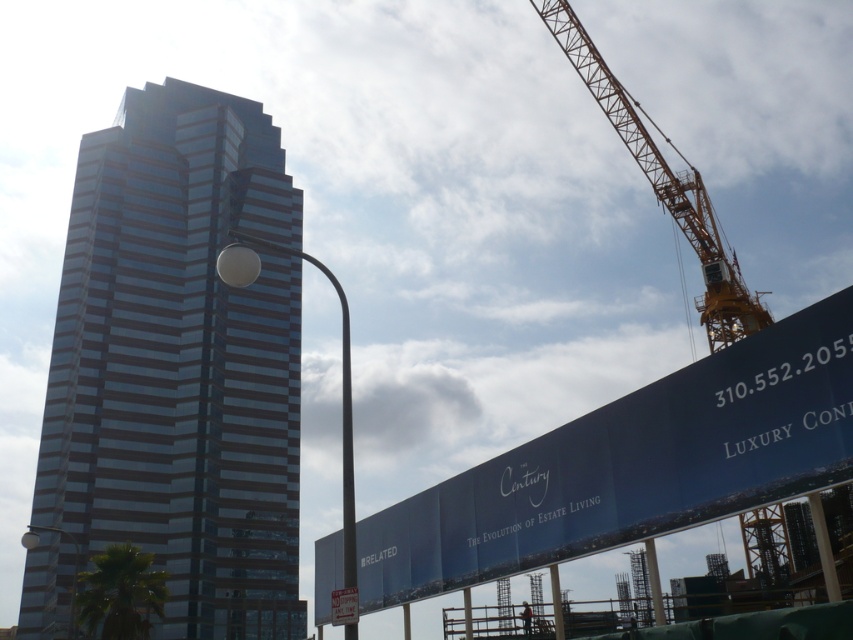
The image size is (853, 640). Describe the element at coordinates (175, 371) in the screenshot. I see `shiny glass skyscraper at center` at that location.

Measure the distance between shiny glass skyscraper at center and camera.

The distance of shiny glass skyscraper at center from camera is 279.76 feet.

What do you see at coordinates (175, 371) in the screenshot? I see `shiny glass skyscraper at center` at bounding box center [175, 371].

What are the coordinates of `shiny glass skyscraper at center` in the screenshot? It's located at (175, 371).